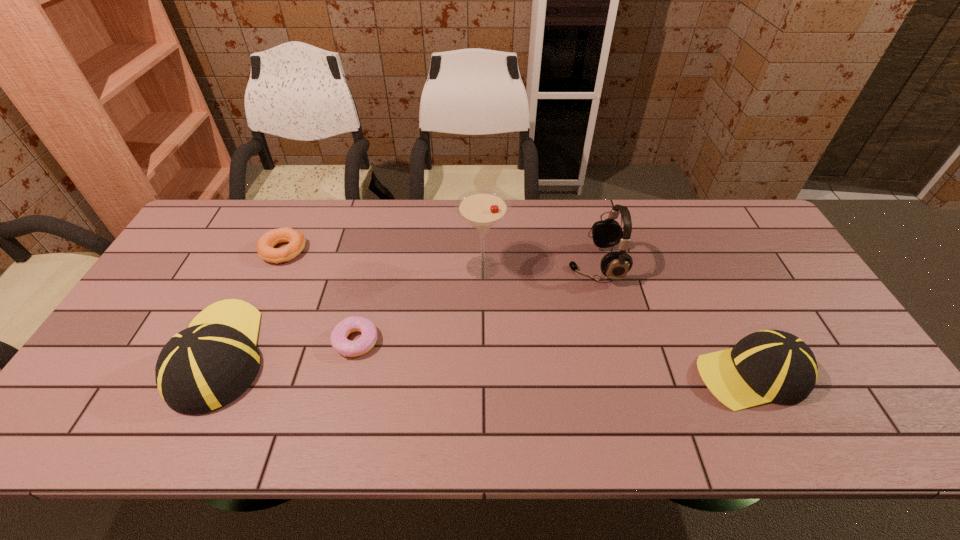
You are a GUI agent. You are given a task and a screenshot of the screen. Output one action in this format:
    pyautogui.click(x=<x>, y=<y>)
    Task: Click on the free point between the third shortest object and the bagel
    
    Given the screenshot: What is the action you would take?
    pyautogui.click(x=517, y=313)

Identify which object is the closest to the right baseball cap. Please provide its 2D coordinates. Your answer should be formatted as a tuple, i.e. [(x, y)], where the tuple contains the x and y coordinates of a point satisfying the conditions above.

[(606, 233)]

Select which object is the fifth closest to the fourth object from right to left. Please provide its 2D coordinates. Your answer should be formatted as a tuple, i.e. [(x, y)], where the tuple contains the x and y coordinates of a point satisfying the conditions above.

[(766, 366)]

Find the location of a particular element. free space that satisfies the following two spatial constraints: 1. with the brim of the fourth object from left to right facing forward; 2. on the right side of the fourth shortest object is located at coordinates (262, 267).

You are a GUI agent. You are given a task and a screenshot of the screen. Output one action in this format:
    pyautogui.click(x=<x>, y=<y>)
    Task: Click on the free space that satisfies the following two spatial constraints: 1. with the brim of the taller baseball cap facing forward; 2. on the right side of the third object from right to left
    The image size is (960, 540).
    Given the screenshot: What is the action you would take?
    pyautogui.click(x=262, y=267)